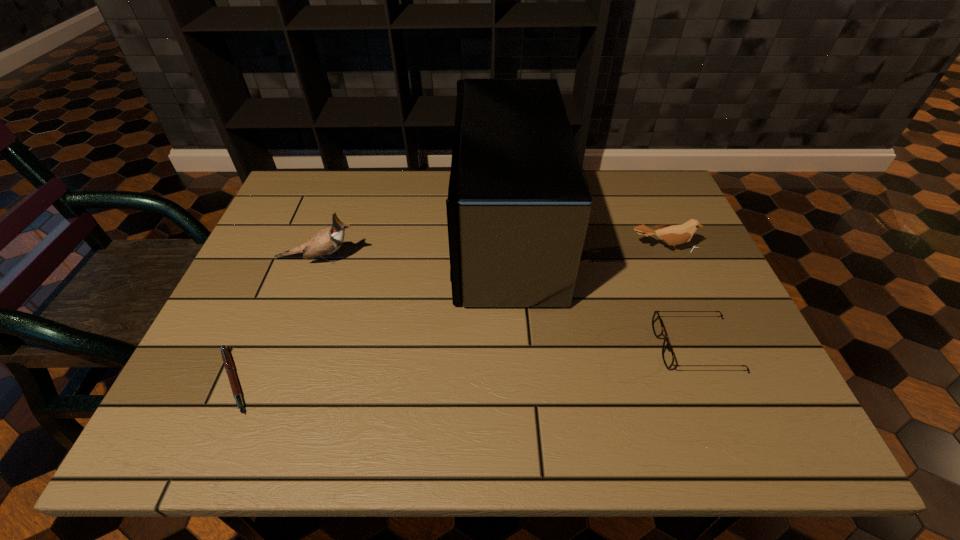
Where is `free spot that satisfies the following two spatial constraints: 1. at the beak of the shorter bird; 2. at the face of the taller bird`? free spot that satisfies the following two spatial constraints: 1. at the beak of the shorter bird; 2. at the face of the taller bird is located at coordinates pos(667,259).

In order to click on free space that satisfies the following two spatial constraints: 1. at the beak of the third tallest object; 2. on the front-facing side of the fourth tallest object in this screenshot , I will do `click(705, 347)`.

Where is `vacant space that satisfies the following two spatial constraints: 1. at the beak of the shorter bird; 2. at the face of the taller bird`? The width and height of the screenshot is (960, 540). vacant space that satisfies the following two spatial constraints: 1. at the beak of the shorter bird; 2. at the face of the taller bird is located at coordinates (667, 259).